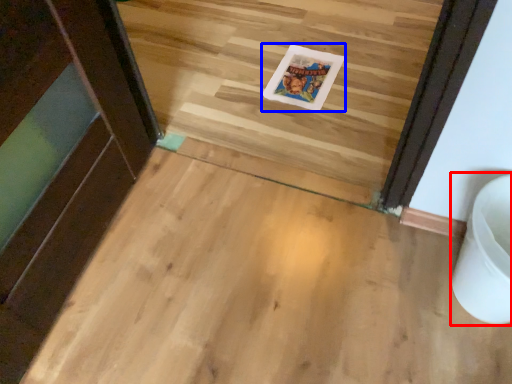
Question: Which point is closer to the camera, toilet bowl (highlighted by a red box) or postcard (highlighted by a blue box)?

Choices:
 (A) toilet bowl
 (B) postcard

Answer: (A)